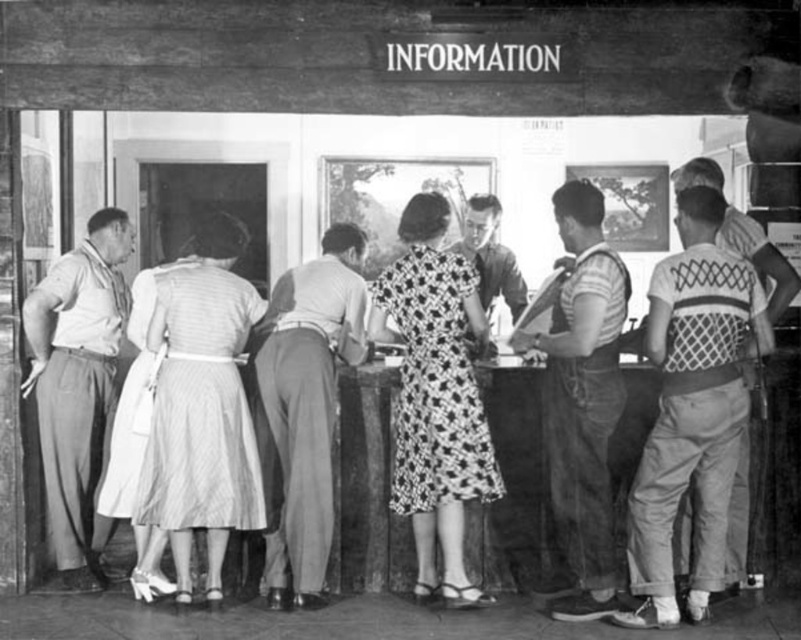
Based on the photo, who is positioned more to the right, printed fabric dress at center or smooth white shirt at left?

From the viewer's perspective, printed fabric dress at center appears more on the right side.

Which is behind, point (445, 545) or point (63, 529)?

The point (63, 529) is more distant.

This screenshot has height=640, width=801. Find the location of `printed fabric dress at center`. printed fabric dress at center is located at coordinates (435, 396).

At what (x,y) coordinates should I click in order to perform the action: click on printed fabric dress at center. Please return your answer as a coordinate pair (x, y). The width and height of the screenshot is (801, 640). Looking at the image, I should click on (435, 396).

In order to click on knitted sweater at right in this screenshot , I will do `click(691, 410)`.

The image size is (801, 640). What do you see at coordinates (691, 410) in the screenshot? I see `knitted sweater at right` at bounding box center [691, 410].

Locate an element on the screen. The width and height of the screenshot is (801, 640). knitted sweater at right is located at coordinates (691, 410).

Consider the image. Who is lower down, knitted sweater at right or light gray cotton pants at center?

light gray cotton pants at center

Is knitted sweater at right above light gray cotton pants at center?

Indeed, knitted sweater at right is positioned over light gray cotton pants at center.

Describe the element at coordinates (691, 410) in the screenshot. The height and width of the screenshot is (640, 801). I see `knitted sweater at right` at that location.

Locate an element on the screen. The height and width of the screenshot is (640, 801). knitted sweater at right is located at coordinates (691, 410).